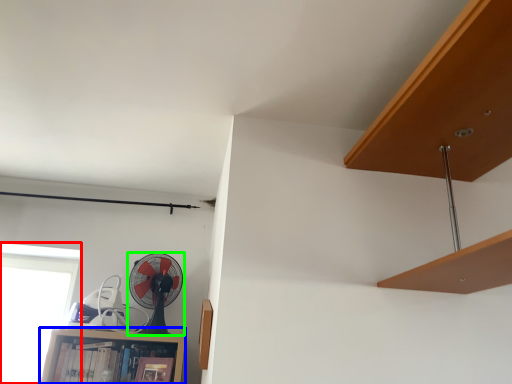
Question: Which object is the farthest from window (highlighted by a red box)? Choose among these: cabinet (highlighted by a blue box) or mechanical fan (highlighted by a green box).

Choices:
 (A) cabinet
 (B) mechanical fan

Answer: (B)